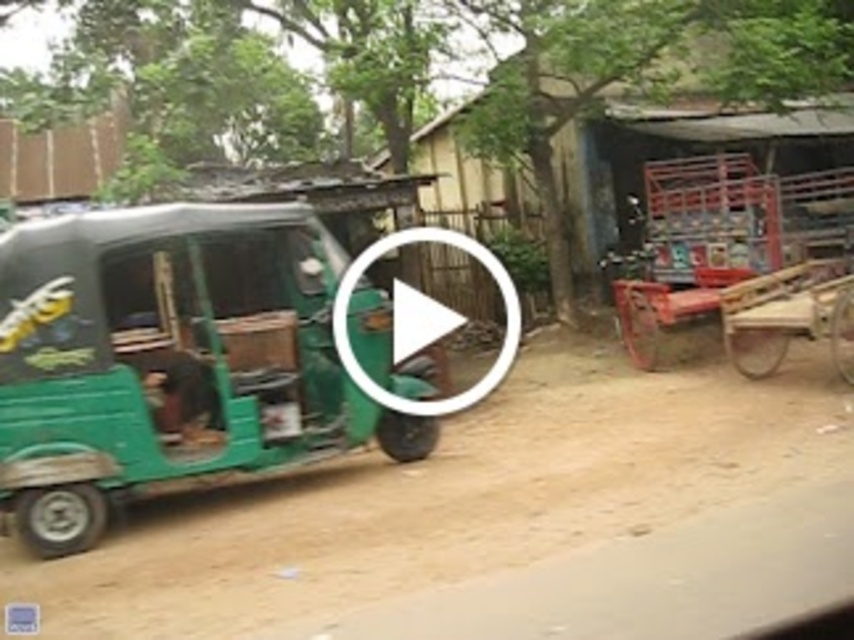
You are driving a car that is 1.8 meters wide. You need to pass through the brown dirt track at center and then go near the rustic wooden hut at center. Can your car fit through the dirt track and then park next to the hut?

The brown dirt track at center might be wider than rustic wooden hut at center. Since the car is 1.8 meters wide, if the dirt track is indeed wider than the hut, it should accommodate the car. However, without exact measurements, there is uncertainty. Proceed with caution.